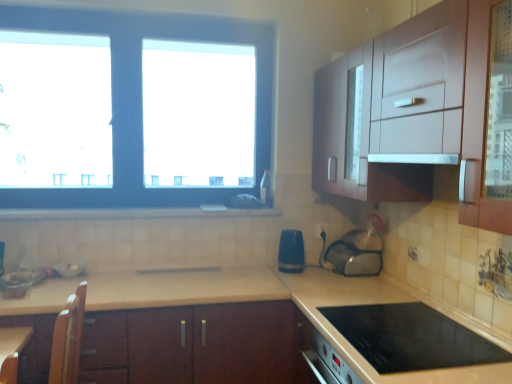
The height and width of the screenshot is (384, 512). I want to click on free space in front of transparent plastic bag at center, marked as the 1th appliance in a right-to-left arrangement, so click(352, 283).